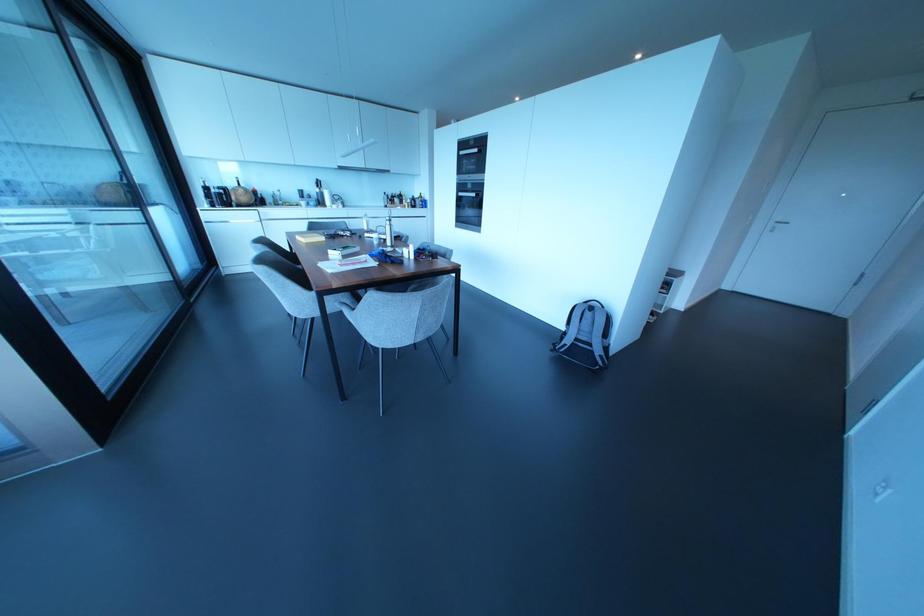
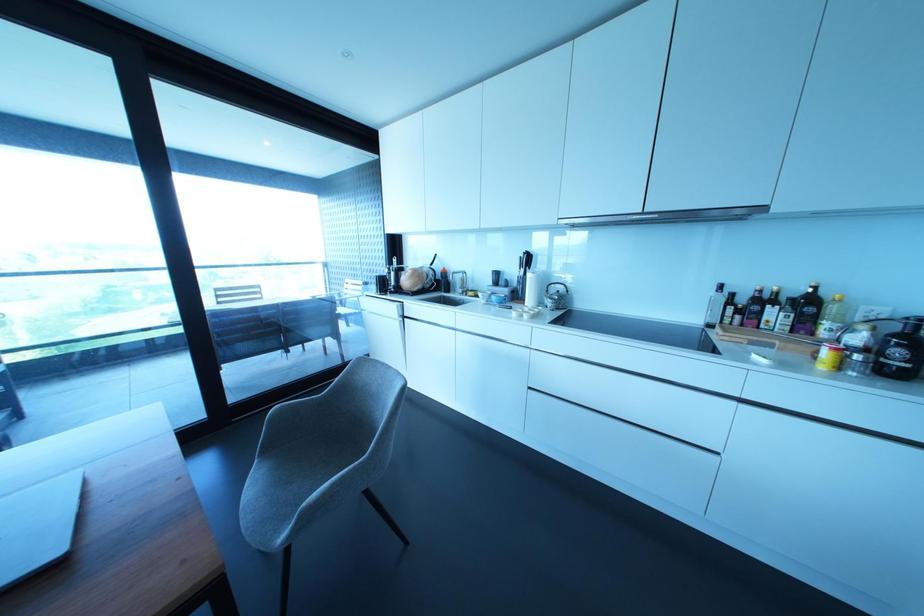
The point at (310, 203) is marked in the first image. Where is the corresponding point in the second image?

(492, 297)